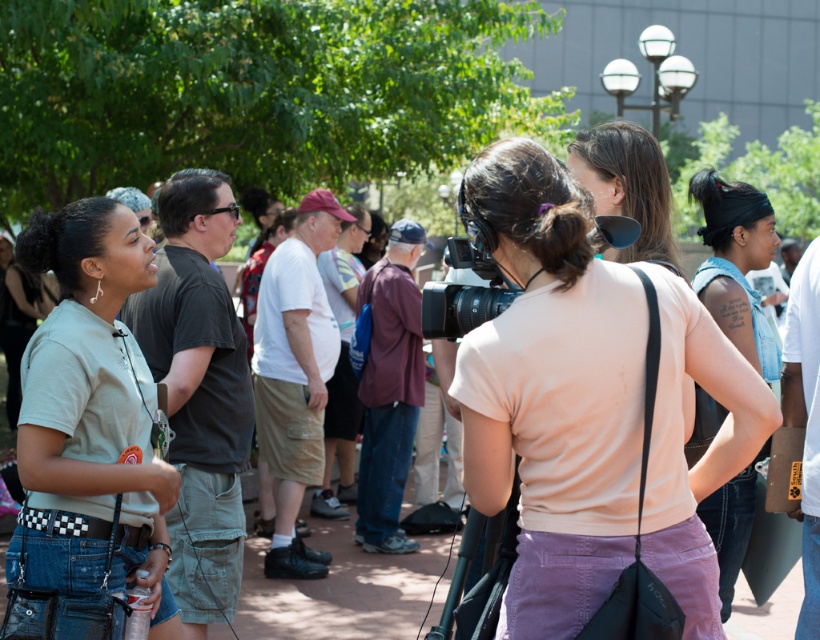
You are a photographer at the event and want to take a photo of the matte pink shirt at center and the matte black video camera at center. Which object should you focus on first if you want to capture both in clear detail?

The matte pink shirt at center is much taller than the matte black video camera at center, so you should focus on the matte pink shirt at center first to ensure both are in clear detail.

You are a photographer trying to capture a clear shot of the event. You notice the light pink cotton shirt at center and the matte black video camera at center. Which object is blocking your view more towards the front?

The light pink cotton shirt at center is blocking your view more towards the front because the matte black video camera at center is behind it.

You are a photographer trying to capture a clear shot of the matte pink shirt at center and the matte black video camera at center. Which object should you focus on first if you want to ensure both are in focus, considering their sizes?

The matte pink shirt at center is bigger than the matte black video camera at center. To ensure both are in focus, you should focus on the larger object, the matte pink shirt at center, as it requires more precise focusing due to its size.